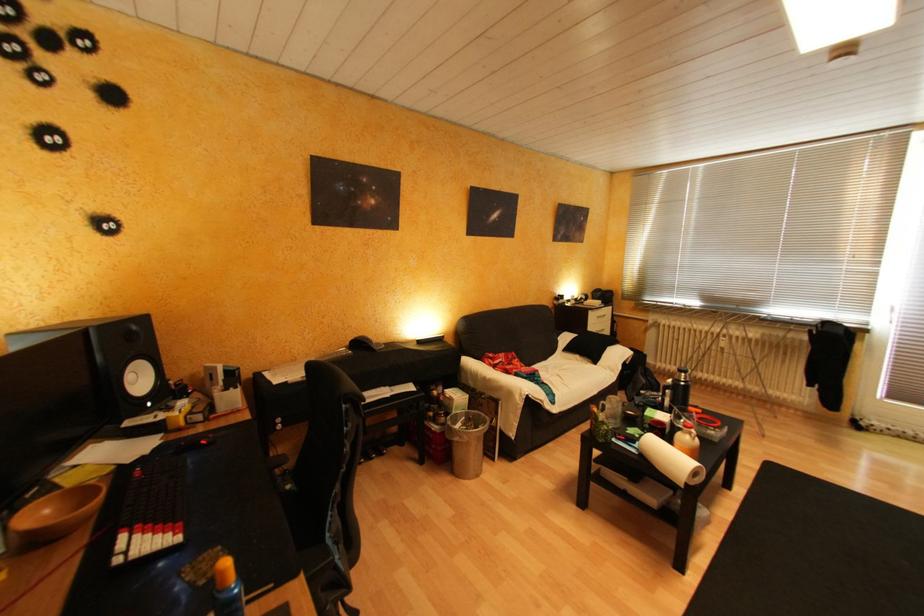
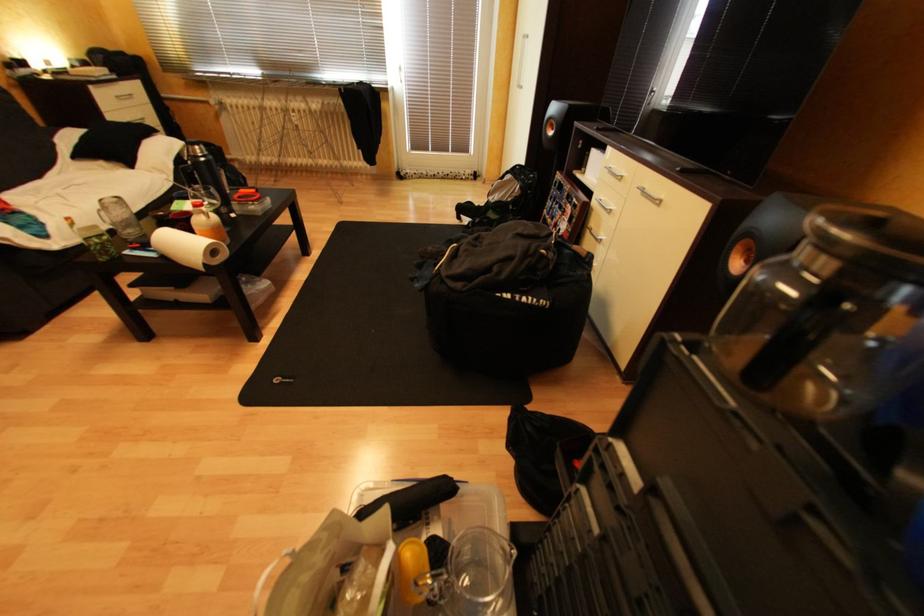
How did the camera likely rotate?

The rotation direction of the camera is right-down.